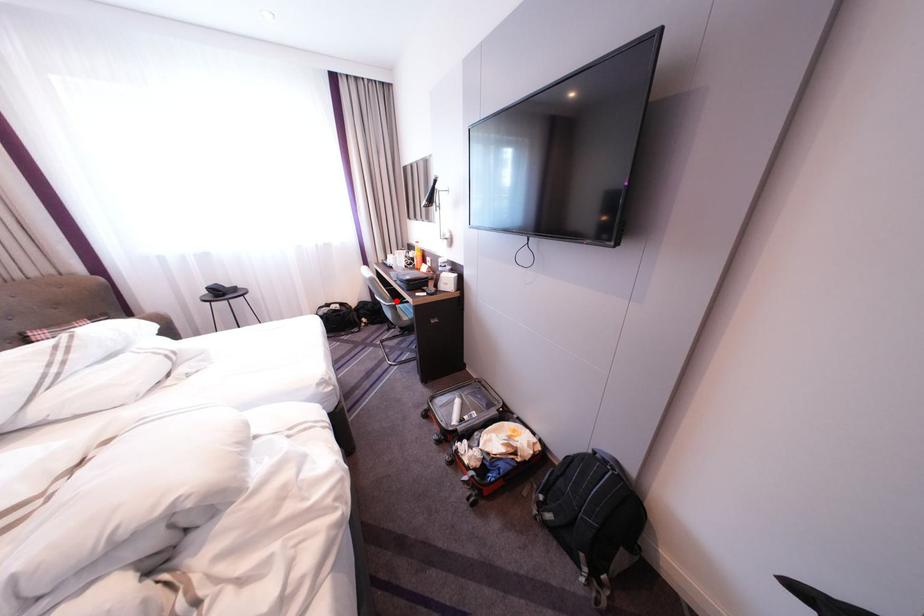
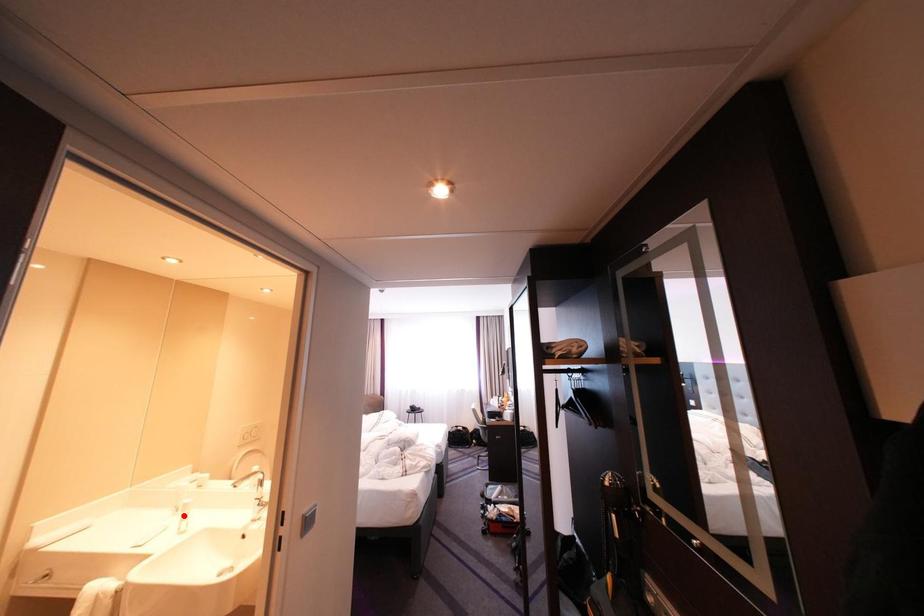
I am providing you with two images of the same scene from different viewpoints. A red point is marked on the first image and another point is marked on the second image. Does the point marked in image1 correspond to the same location as the one in image2?

No